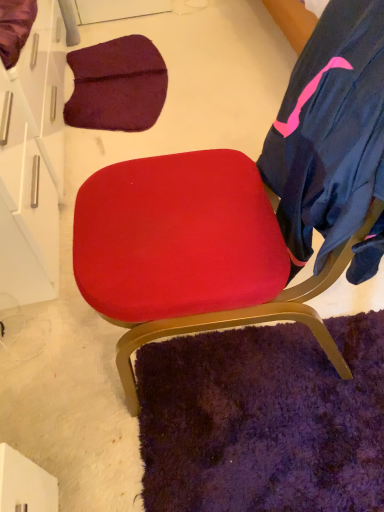
Question: In terms of height, does suede red chair at center look taller or shorter compared to white glossy drawer at upper left?

Choices:
 (A) tall
 (B) short

Answer: (A)

Question: Is suede red chair at center to the left or to the right of white glossy drawer at upper left in the image?

Choices:
 (A) right
 (B) left

Answer: (A)

Question: Which is farther from the dark blue fabric robe at right?

Choices:
 (A) white glossy drawer at upper left
 (B) suede red chair at center

Answer: (A)

Question: Which of these objects is positioned closest to the dark blue fabric robe at right?

Choices:
 (A) suede red chair at center
 (B) white glossy drawer at upper left

Answer: (A)